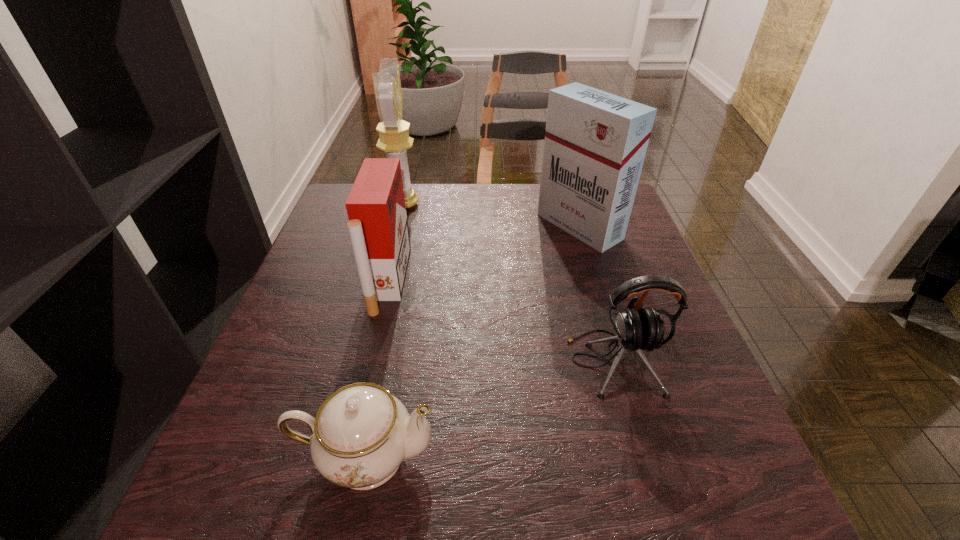
Find the location of a particular element. The width and height of the screenshot is (960, 540). award is located at coordinates click(x=394, y=139).

Where is `the right cigarette case`? The width and height of the screenshot is (960, 540). the right cigarette case is located at coordinates (595, 144).

This screenshot has height=540, width=960. In order to click on the shorter cigarette case in this screenshot , I will do click(x=378, y=228).

You are a GUI agent. You are given a task and a screenshot of the screen. Output one action in this format:
    pyautogui.click(x=<x>, y=<y>)
    Task: Click on the fourth farthest object
    
    Given the screenshot: What is the action you would take?
    pyautogui.click(x=637, y=329)

Find the location of a particular element. The height and width of the screenshot is (540, 960). the nearest object is located at coordinates (361, 434).

Find the location of `chinaware`. chinaware is located at coordinates (361, 434).

You are a GUI agent. You are given a task and a screenshot of the screen. Output one action in this format:
    pyautogui.click(x=<x>, y=<y>)
    Task: Click on the free location located 0.160m on the front-facing side of the award
    The image size is (960, 540).
    Given the screenshot: What is the action you would take?
    pyautogui.click(x=475, y=204)

Locate an element on the screen. The width and height of the screenshot is (960, 540). vacant space situated 0.180m on the left of the right cigarette case is located at coordinates (472, 226).

The image size is (960, 540). What are the coordinates of `vacant space located 0.350m on the front-facing side of the shorter cigarette case` in the screenshot? It's located at (557, 280).

You are a GUI agent. You are given a task and a screenshot of the screen. Output one action in this format:
    pyautogui.click(x=<x>, y=<y>)
    Task: Click on the vacant point located 0.100m on the back of the second nearest object
    This screenshot has height=540, width=960.
    Given the screenshot: What is the action you would take?
    pyautogui.click(x=595, y=296)